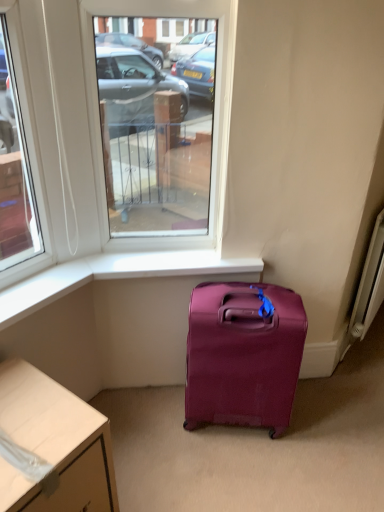
Question: Could matte purple suitcase at lower center be considered to be inside white metallic radiator at right?

Choices:
 (A) no
 (B) yes

Answer: (A)

Question: Is white metallic radiator at right not within matte purple suitcase at lower center?

Choices:
 (A) yes
 (B) no

Answer: (A)

Question: Is white metallic radiator at right oriented towards matte purple suitcase at lower center?

Choices:
 (A) no
 (B) yes

Answer: (A)

Question: Does white metallic radiator at right have a smaller size compared to matte purple suitcase at lower center?

Choices:
 (A) no
 (B) yes

Answer: (B)

Question: From a real-world perspective, is white metallic radiator at right over matte purple suitcase at lower center?

Choices:
 (A) no
 (B) yes

Answer: (B)

Question: Is matte purple suitcase at lower center at the back of white metallic radiator at right?

Choices:
 (A) yes
 (B) no

Answer: (B)

Question: Considering the relative positions of matte purple suitcase at lower center and clear glass window at center in the image provided, is matte purple suitcase at lower center to the right of clear glass window at center from the viewer's perspective?

Choices:
 (A) no
 (B) yes

Answer: (B)

Question: Considering the relative positions of matte purple suitcase at lower center and clear glass window at center in the image provided, is matte purple suitcase at lower center to the left of clear glass window at center from the viewer's perspective?

Choices:
 (A) no
 (B) yes

Answer: (A)

Question: From the image's perspective, would you say matte purple suitcase at lower center is positioned over clear glass window at center?

Choices:
 (A) no
 (B) yes

Answer: (A)

Question: From the image's perspective, is matte purple suitcase at lower center under clear glass window at center?

Choices:
 (A) yes
 (B) no

Answer: (A)

Question: Does matte purple suitcase at lower center have a lesser width compared to clear glass window at center?

Choices:
 (A) yes
 (B) no

Answer: (B)

Question: From a real-world perspective, is matte purple suitcase at lower center physically below clear glass window at center?

Choices:
 (A) no
 (B) yes

Answer: (B)

Question: Is white glossy desk at lower left smaller than matte purple suitcase at lower center?

Choices:
 (A) no
 (B) yes

Answer: (A)